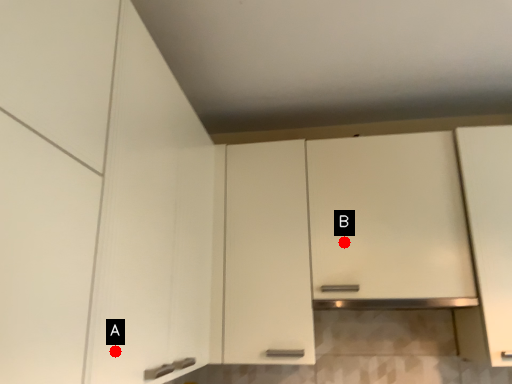
Question: Two points are circled on the image, labeled by A and B beside each circle. Which point is farther from the camera taking this photo?

Choices:
 (A) A is further
 (B) B is further

Answer: (B)